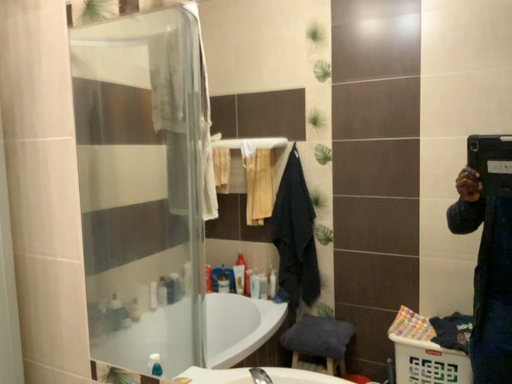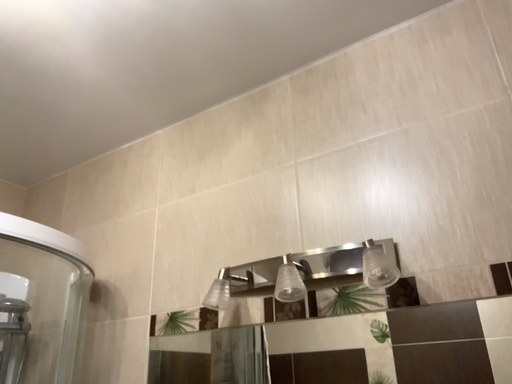
Question: Which way did the camera rotate in the video?

Choices:
 (A) rotated downward
 (B) rotated upward

Answer: (B)